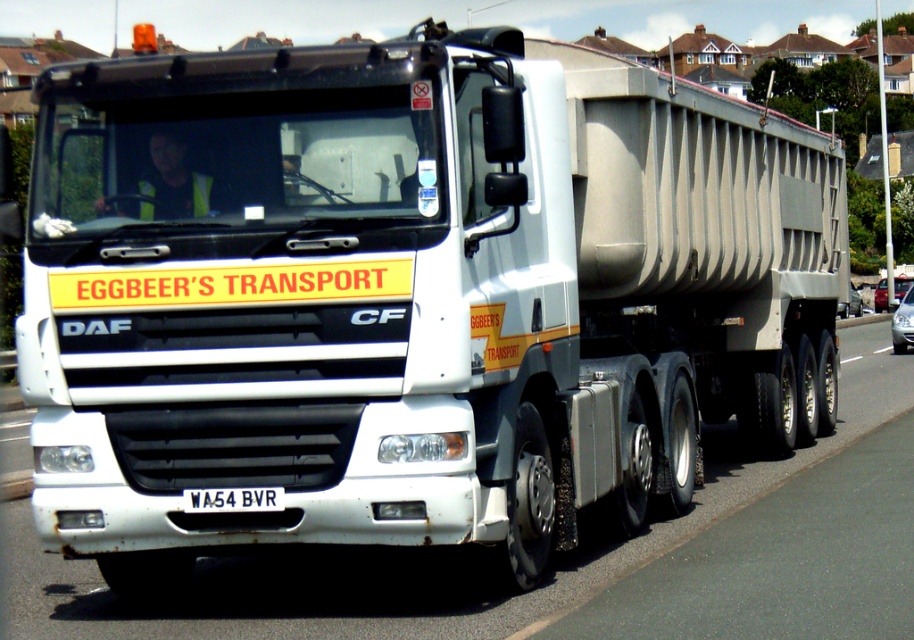
You are driving a metallic silver car at right and want to park it in a spot that is directly in front of the DAF CF model truck. Given the truck is parked on the road, can you estimate if there is enough space between the truck and the curb to park your car?

The metallic silver car at right is located at point [880,296]. However, without specific dimensions of the parking space or the distance between the truck and the curb, it is impossible to determine if there is enough space to park the car directly in front of the truck.

You are a parking attendant trying to fit both the satin silver sedan at center and the metallic silver car at right into a parking space that is 2.5 meters wide. Based on their widths, can both vehicles fit side by side without overlapping?

The satin silver sedan at center is wider than the metallic silver car at right. Since the parking space is 2.5 meters wide, it depends on their exact widths. However, the description only states that the satin silver sedan at center is wider, but does not provide specific measurements. Without knowing the exact widths, it is impossible to determine if both can fit side by side without overlapping.

You are a photographer trying to capture the license plate of the white plastic license plate at center and the metallic silver car at right in the same frame. Since the license plate is smaller, will you need to adjust your camera angle to include both objects fully?

The white plastic license plate at center has a lesser width compared to the metallic silver car at right, so you may need to adjust your camera angle to ensure both objects are fully visible in the frame.